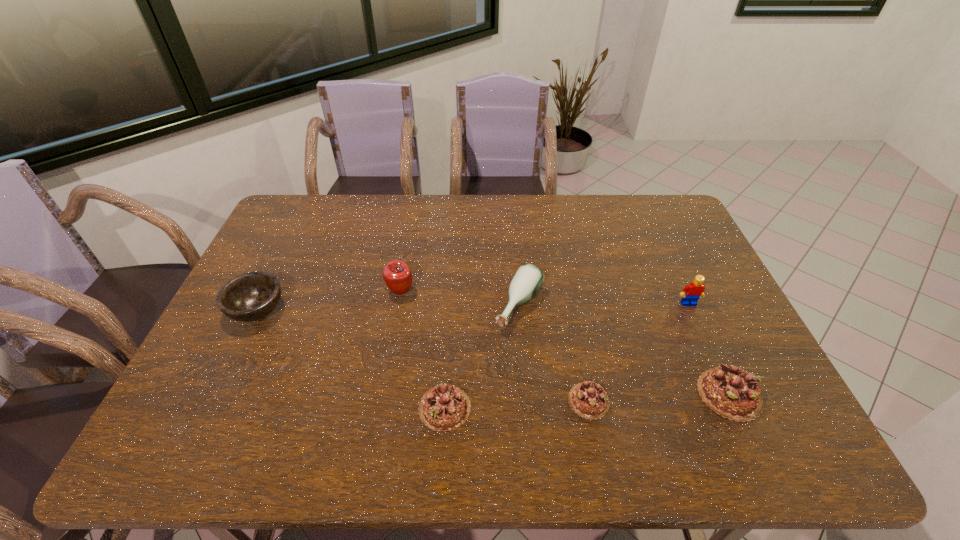
Locate an element on the screen. vacant region at the far edge of the desktop is located at coordinates (498, 198).

At what (x,y) coordinates should I click in order to perform the action: click on vacant space at the left edge of the desktop. Please return your answer as a coordinate pair (x, y). Looking at the image, I should click on (266, 267).

At what (x,y) coordinates should I click in order to perform the action: click on vacant space at the right edge. Please return your answer as a coordinate pair (x, y). Looking at the image, I should click on (732, 326).

In the image, there is a desktop. At what (x,y) coordinates should I click in order to perform the action: click on vacant space at the far left corner. Please return your answer as a coordinate pair (x, y). The height and width of the screenshot is (540, 960). Looking at the image, I should click on (294, 221).

In order to click on empty space that is in between the second chocolate cake from right to left and the second shortest chocolate cake in this screenshot , I will do `click(516, 404)`.

Identify the location of vacant area that lies between the apple and the bottle. (460, 299).

I want to click on unoccupied area between the second tallest chocolate cake and the fourth object from left to right, so click(x=482, y=357).

Find the location of a particular element. free spot between the bottle and the second shortest object is located at coordinates (482, 357).

Find the location of a particular element. free space between the bowl and the rightmost chocolate cake is located at coordinates (493, 352).

Locate an element on the screen. Image resolution: width=960 pixels, height=540 pixels. blank region between the bottle and the tallest chocolate cake is located at coordinates (624, 350).